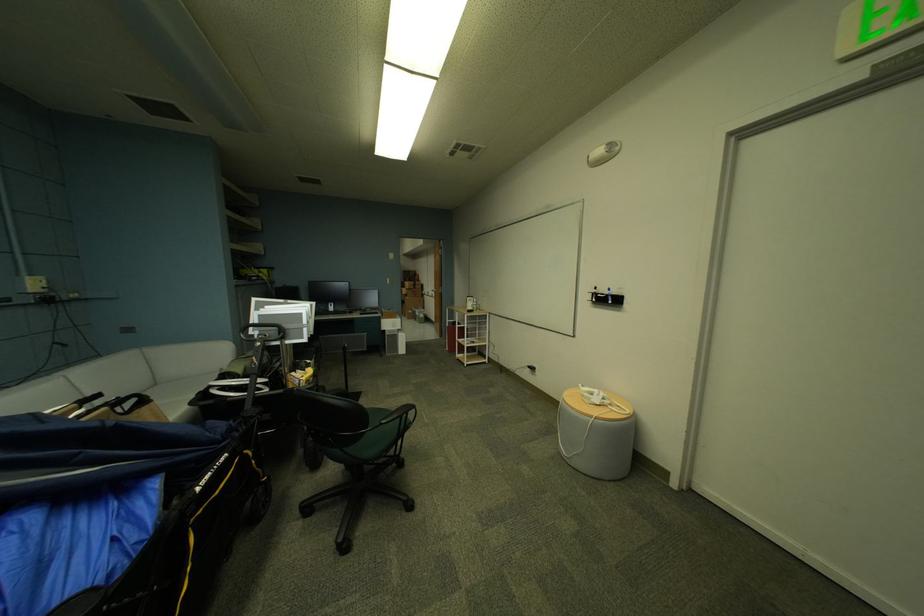
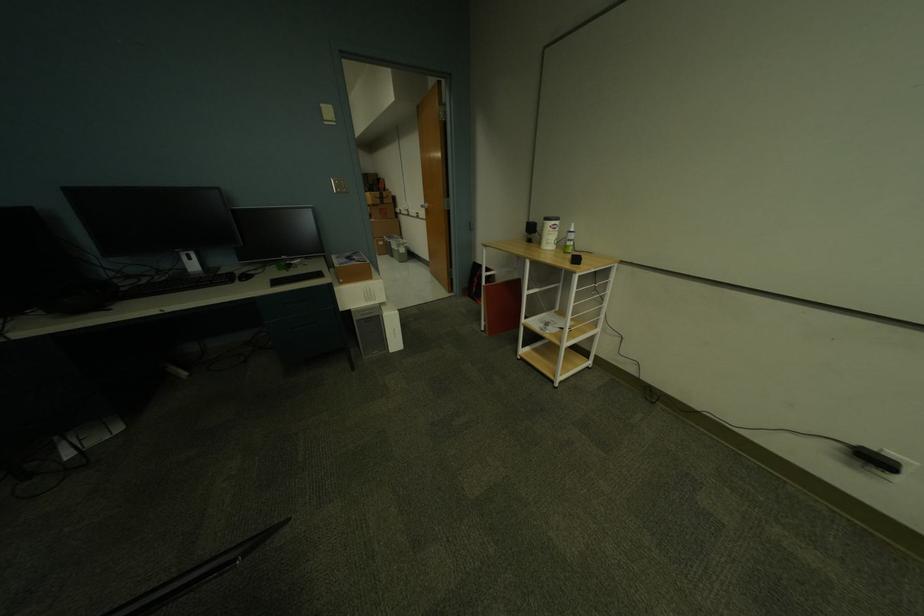
The point at (421, 284) is marked in the first image. Where is the corresponding point in the second image?

(386, 195)